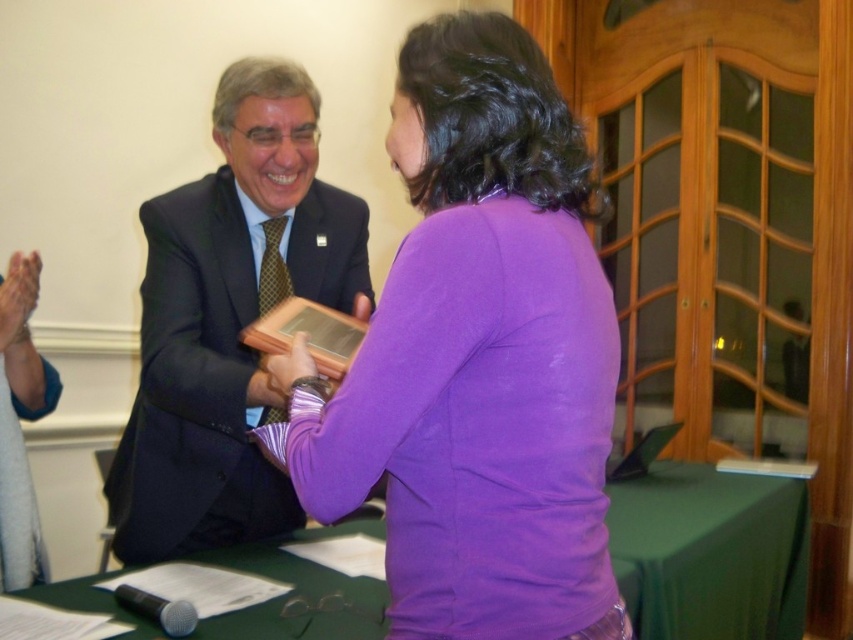
You are standing in the center of the event hall and see the scene described. There is a point at coordinates (228, 320). What object is located at that point?

The point at coordinates (228, 320) marks the matte black suit at center.

You are organizing a photo shoot and need to ensure that the purple matte shirt at center and the green fabric table at center are positioned correctly according to the scene. Based on the description, which object is closer to the left side of the frame?

The purple matte shirt at center is closer to the left side of the frame because it is positioned to the left of the green fabric table at center.

You are a photographer at the event and need to adjust your camera to focus on both the matte black suit at center and the green fabric table at center. Which one is closer to the camera?

The matte black suit at center is much taller than the green fabric table at center, so the camera would need to focus on the taller object first.